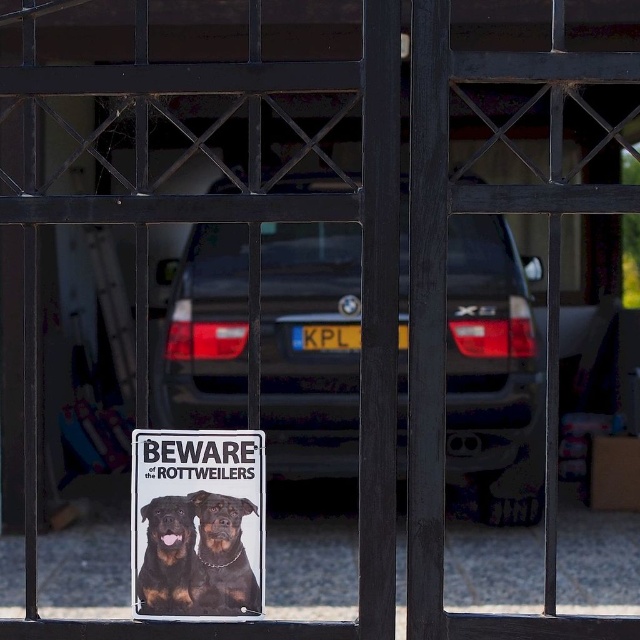
Does matte black car at center have a smaller size compared to rottweiler at center?

Incorrect, matte black car at center is not smaller in size than rottweiler at center.

Between point (172, 307) and point (237, 522), which one is positioned in front?

Positioned in front is point (237, 522).

Does point (529, 259) lie in front of point (216, 518)?

No, (529, 259) is behind (216, 518).

Locate an element on the screen. Image resolution: width=640 pixels, height=640 pixels. matte black car at center is located at coordinates (492, 372).

Between metallic silver sign at center and brown fur dog at center, which one is positioned lower?

brown fur dog at center

This screenshot has height=640, width=640. Describe the element at coordinates (196, 522) in the screenshot. I see `metallic silver sign at center` at that location.

I want to click on metallic silver sign at center, so click(x=196, y=522).

Between point (310, 232) and point (156, 545), which one is positioned behind?

Point (310, 232)

Based on the photo, can you confirm if matte black car at center is bigger than brown fur dog at center?

Correct, matte black car at center is larger in size than brown fur dog at center.

At what (x,y) coordinates should I click in order to perform the action: click on matte black car at center. Please return your answer as a coordinate pair (x, y). Looking at the image, I should click on (492, 372).